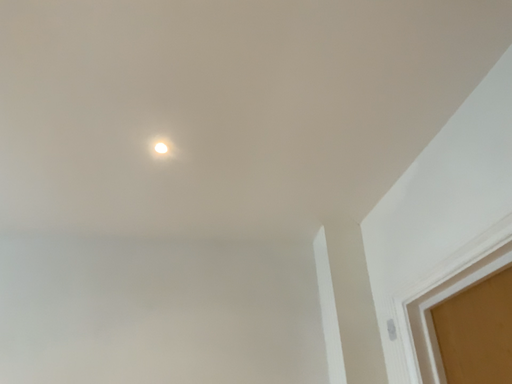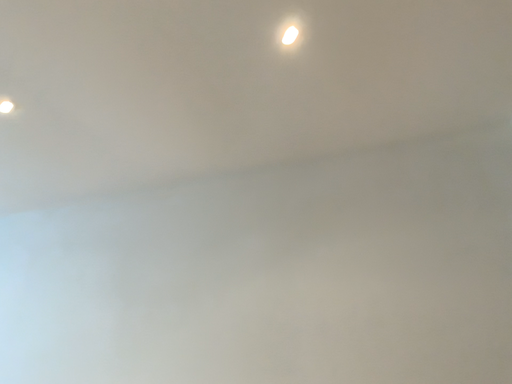
Question: Which way did the camera rotate in the video?

Choices:
 (A) rotated right
 (B) rotated left

Answer: (B)